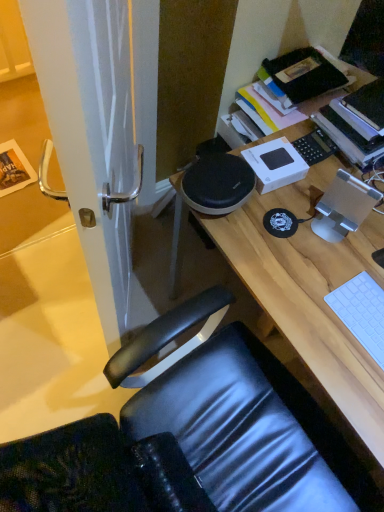
Locate an element on the screen. free space behind white matte keyboard at lower right is located at coordinates (346, 256).